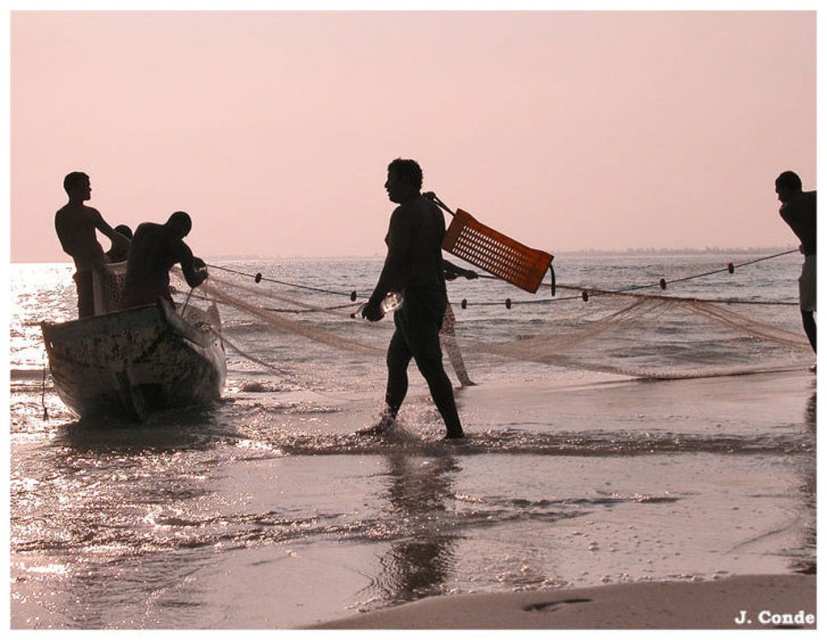
You are a photographer trying to capture the entire scene of the beach. You notice the translucent wet sand at lower center and the smooth skin man at right. Which object would you need to focus on more carefully to ensure it isn t too small in the photo?

The smooth skin man at right needs more careful focus because it is smaller in size compared to the translucent wet sand at lower center, so ensuring proper focus on the smaller object will help it appear clearer in the photo.

You are a photographer trying to capture the scene from the shore. You want to position yourself so that the rusty metal boat at lower left is visible behind the smooth skin man at right. Is this possible based on their positions?

Yes, the rusty metal boat at lower left is positioned below the smooth skin man at right, so it can be seen behind him if you angle your camera appropriately.